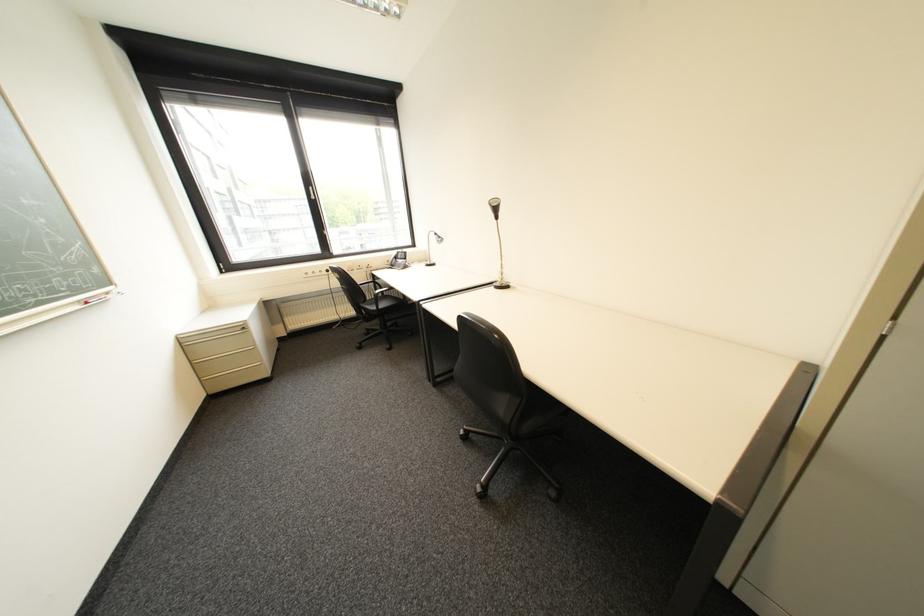
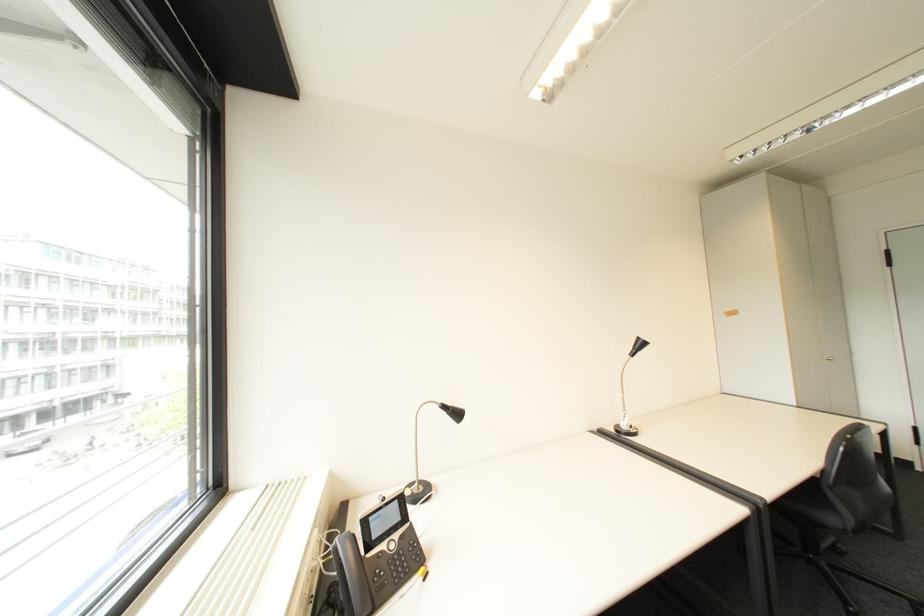
In the second image, find the point that corresponds to [445,235] in the first image.

(455, 407)